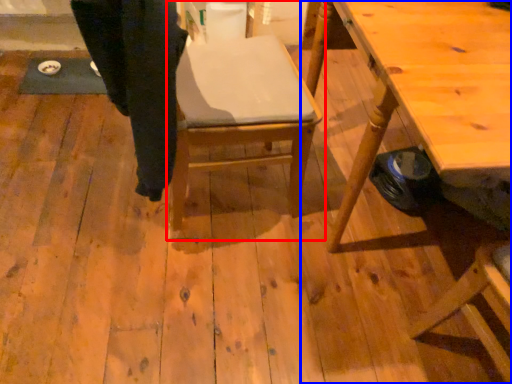
Question: Which of the following is the farthest to the observer, chair (highlighted by a red box) or table (highlighted by a blue box)?

Choices:
 (A) chair
 (B) table

Answer: (A)